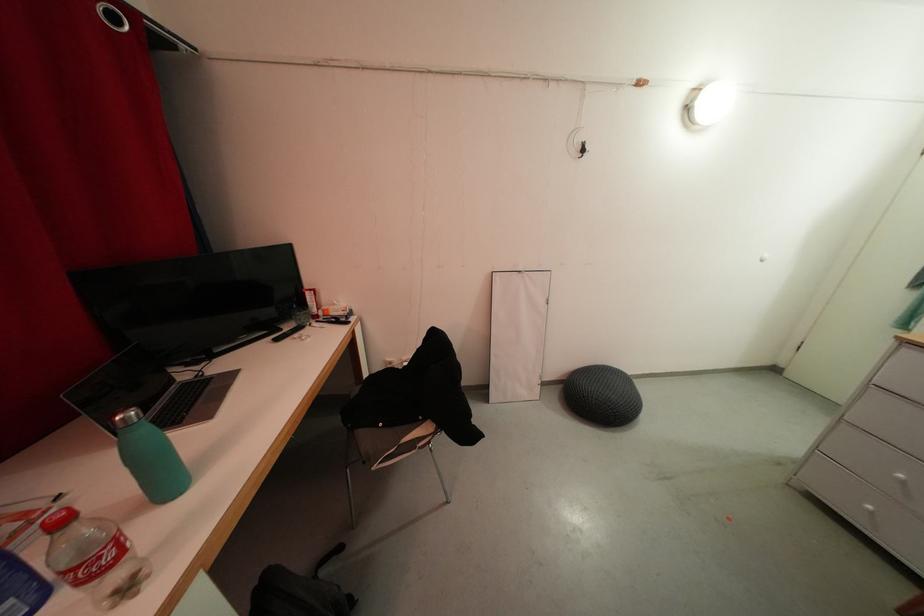
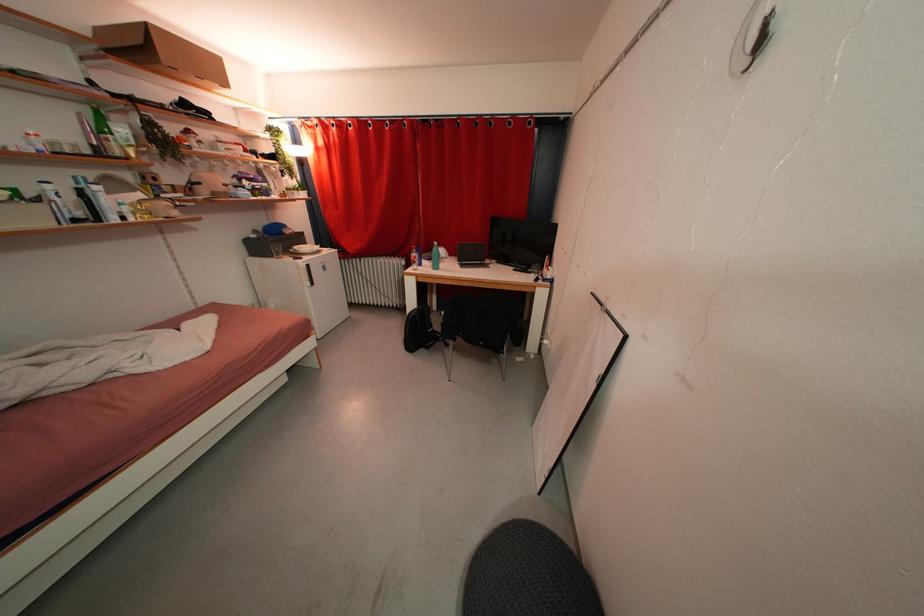
Locate, in the second image, the point that corresponds to (x=353, y=321) in the first image.

(551, 284)